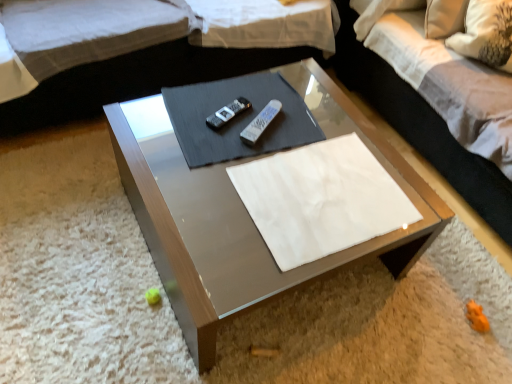
The image size is (512, 384). What are the coordinates of `empty space that is in between black plastic remote at center, placed as the first remote when sorted from left to right, and white paper at center` in the screenshot? It's located at (276, 134).